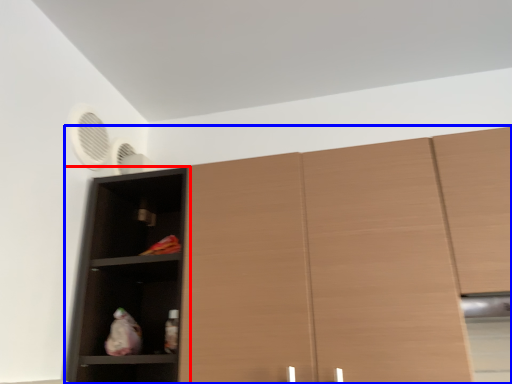
Question: Which object appears closest to the camera in this image, shelf (highlighted by a red box) or cupboard (highlighted by a blue box)?

Choices:
 (A) shelf
 (B) cupboard

Answer: (B)